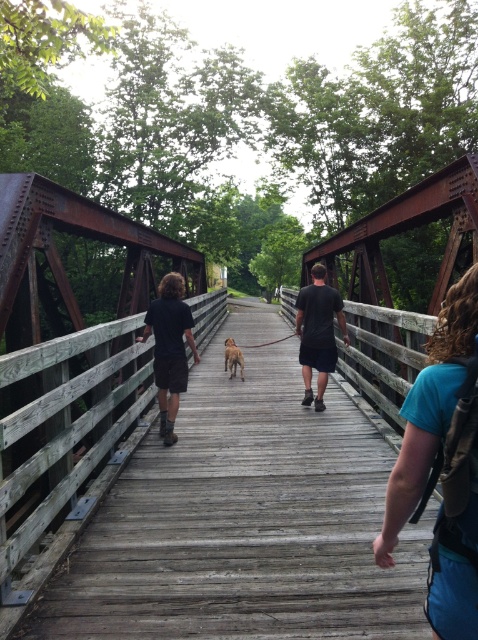
Based on the photo, which is below, black matte shorts at center or brown furry dog at center?

brown furry dog at center is lower down.

At what (x,y) coordinates should I click in order to perform the action: click on black matte shorts at center. Please return your answer as a coordinate pair (x, y). The height and width of the screenshot is (640, 478). Looking at the image, I should click on (317, 332).

Who is positioned more to the right, brown furry dog at center or brown leather leash at center?

From the viewer's perspective, brown leather leash at center appears more on the right side.

Who is more distant from viewer, (229, 358) or (292, 333)?

The point (292, 333) is behind.

Between point (231, 346) and point (248, 346), which one is positioned behind?

The point (248, 346) is more distant.

This screenshot has width=478, height=640. Identify the location of brown furry dog at center. (232, 356).

Between wooden bridge at center and black matte shorts at center, which one appears on the right side from the viewer's perspective?

black matte shorts at center

Can you confirm if wooden bridge at center is positioned above black matte shorts at center?

No.

The width and height of the screenshot is (478, 640). Find the location of `wooden bridge at center`. wooden bridge at center is located at coordinates (245, 518).